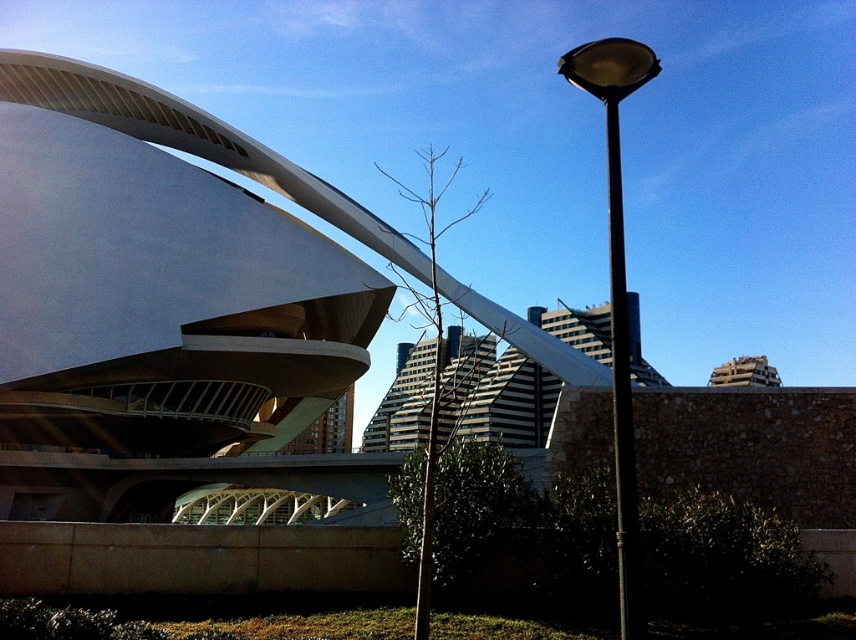
Question: Does black metal pole at upper right appear on the left side of black metal pole at right?

Choices:
 (A) no
 (B) yes

Answer: (B)

Question: Which point is closer to the camera?

Choices:
 (A) black metal pole at upper right
 (B) black metal pole at right

Answer: (A)

Question: Among these points, which one is nearest to the camera?

Choices:
 (A) (635, 579)
 (B) (617, 586)

Answer: (A)

Question: Does black metal pole at upper right appear on the left side of black metal pole at right?

Choices:
 (A) yes
 (B) no

Answer: (A)

Question: Which object is farther from the camera taking this photo?

Choices:
 (A) black metal pole at upper right
 (B) black metal pole at right

Answer: (B)

Question: Is black metal pole at upper right thinner than black metal pole at right?

Choices:
 (A) no
 (B) yes

Answer: (A)